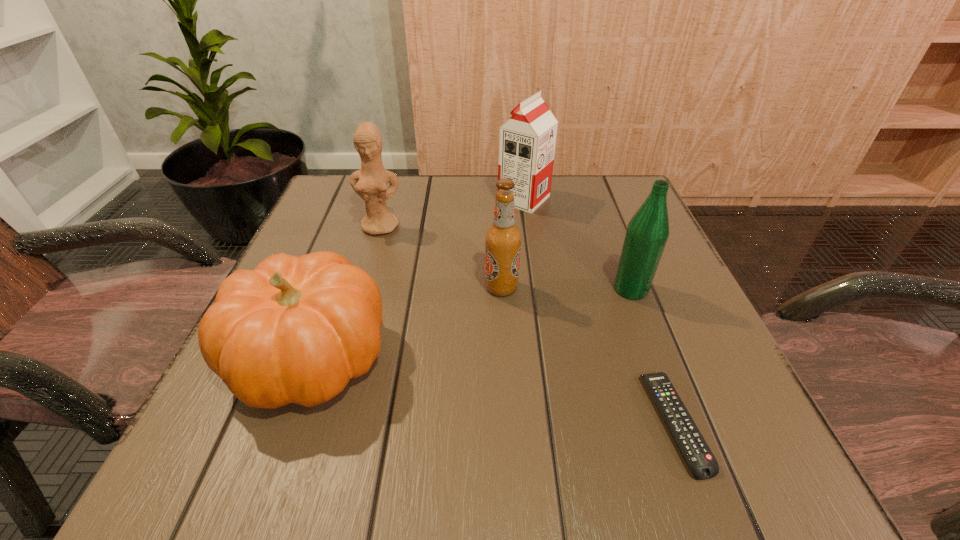
At what (x,y) coordinates should I click in order to perform the action: click on bottle at the right edge. Please return your answer as a coordinate pair (x, y). Looking at the image, I should click on (647, 232).

Identify the location of remote control present at the right edge. (702, 463).

Locate an element on the screen. This screenshot has width=960, height=540. object that is at the far left corner is located at coordinates (370, 182).

This screenshot has height=540, width=960. In order to click on object positioned at the near left corner in this screenshot , I will do `click(295, 329)`.

Image resolution: width=960 pixels, height=540 pixels. In order to click on object that is at the near right corner in this screenshot , I will do `click(702, 463)`.

This screenshot has height=540, width=960. In order to click on vacant area at the far edge of the desktop in this screenshot , I will do `click(408, 199)`.

In the image, there is a desktop. Where is `vacant space at the near edge`? The image size is (960, 540). vacant space at the near edge is located at coordinates tap(630, 465).

Where is `free space at the left edge of the desktop`? The width and height of the screenshot is (960, 540). free space at the left edge of the desktop is located at coordinates (293, 247).

The height and width of the screenshot is (540, 960). Find the location of `vacant space at the right edge of the desktop`. vacant space at the right edge of the desktop is located at coordinates (599, 279).

Locate an element on the screen. The image size is (960, 540). free space at the far left corner of the desktop is located at coordinates (333, 183).